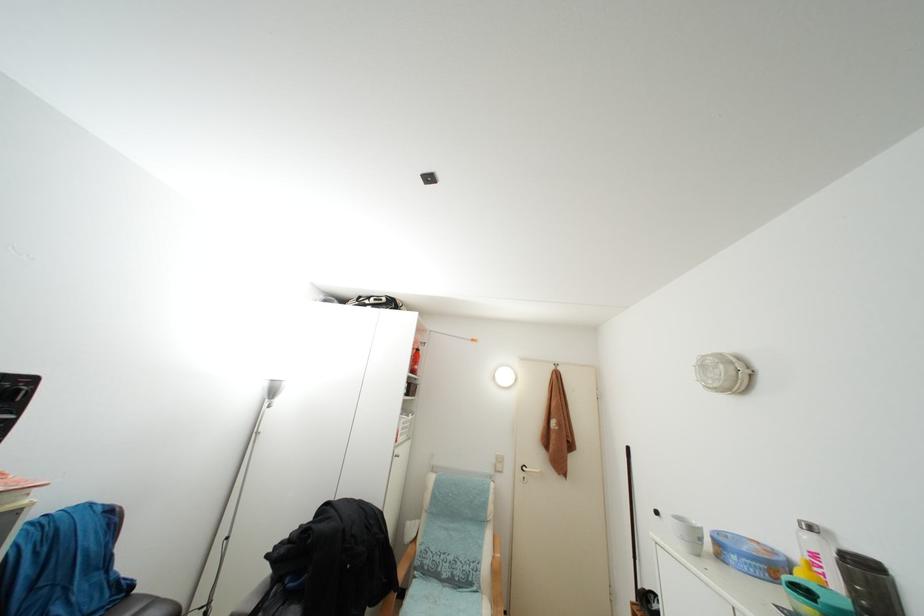
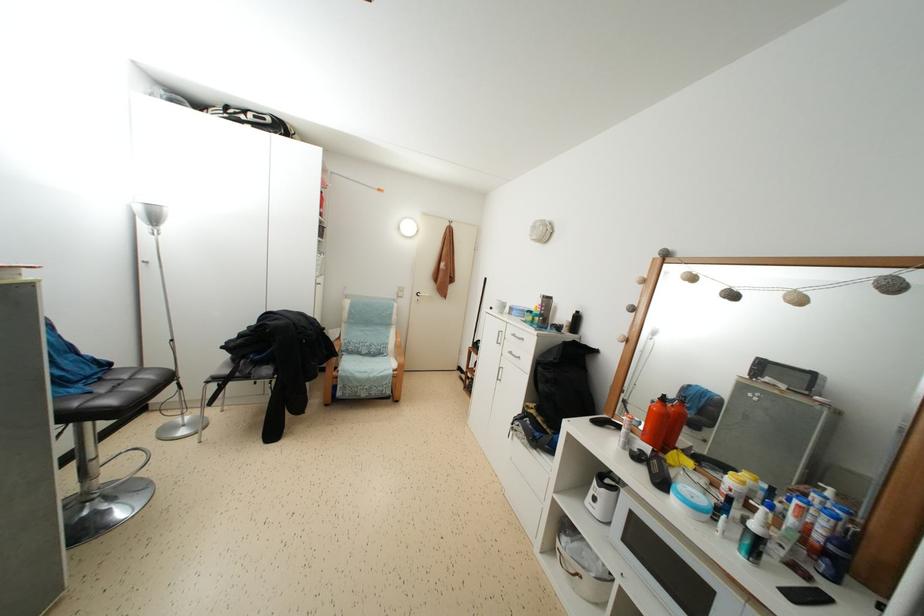
Locate, in the second image, the point that corresponds to (541,463) in the first image.

(432, 293)